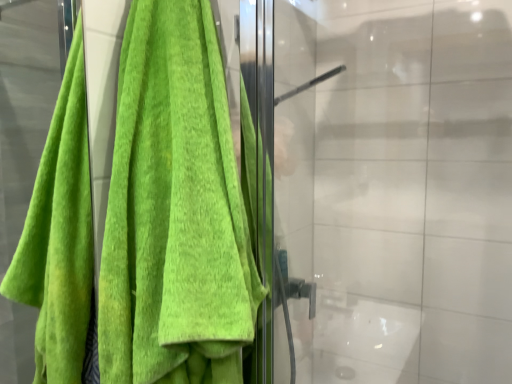
Question: In terms of width, does green terry cloth towel at left look wider or thinner when compared to transparent glass door at center?

Choices:
 (A) thin
 (B) wide

Answer: (A)

Question: Is point (129, 251) positioned closer to the camera than point (285, 135)?

Choices:
 (A) farther
 (B) closer

Answer: (B)

Question: Considering their positions, is green terry cloth towel at left located in front of or behind transparent glass door at center?

Choices:
 (A) front
 (B) behind

Answer: (A)

Question: Considering their positions, is transparent glass door at center located in front of or behind green terry cloth towel at left?

Choices:
 (A) behind
 (B) front

Answer: (A)

Question: Is point (384, 193) positioned closer to the camera than point (132, 256)?

Choices:
 (A) closer
 (B) farther

Answer: (B)

Question: From a real-world perspective, is transparent glass door at center positioned above or below green terry cloth towel at left?

Choices:
 (A) above
 (B) below

Answer: (B)

Question: Considering the positions of transparent glass door at center and green terry cloth towel at left in the image, is transparent glass door at center taller or shorter than green terry cloth towel at left?

Choices:
 (A) short
 (B) tall

Answer: (B)